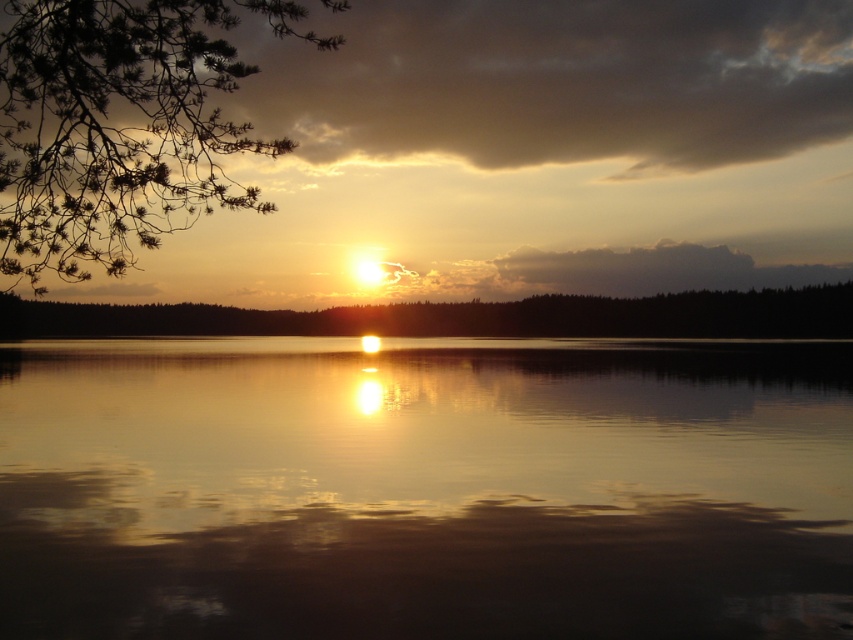
You are a photographer standing at the edge of the water. You want to capture a photo that includes both the glistening reflective water at center and the green matte tree at center. Given that your camera can focus on objects up to 200 feet away, will both objects be in focus?

The glistening reflective water at center is 201.18 feet from the green matte tree at center. Since the distance between them exceeds the camera focus range of 200 feet, both objects cannot be in focus simultaneously.

You are an artist trying to paint the sunset scene. You want to ensure the green matte tree at center is placed above the glistening reflective water at center in your painting. Does the current arrangement in the image allow this?

Yes, the glistening reflective water at center is below the green matte tree at center, so placing the green matte tree at center above the glistening reflective water at center in the painting matches the scene.

Consider the image. You are standing at the edge of the lake and see two points in the scene. The first point is at coordinates point (10, 612) and the second is at point (204, 182). Which point is closer to you?

Point (10, 612) is closer to the viewer than point (204, 182).